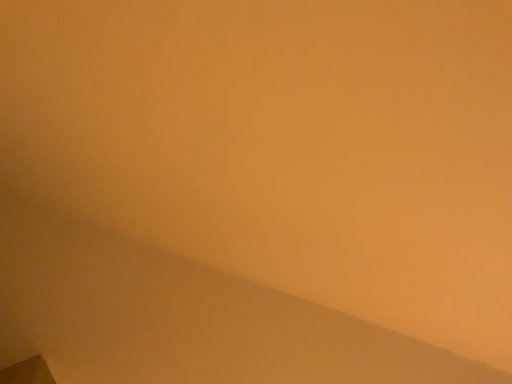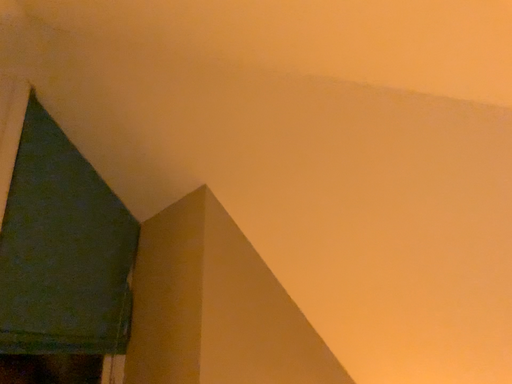
Question: How did the camera likely rotate when shooting the video?

Choices:
 (A) rotated downward
 (B) rotated upward

Answer: (A)